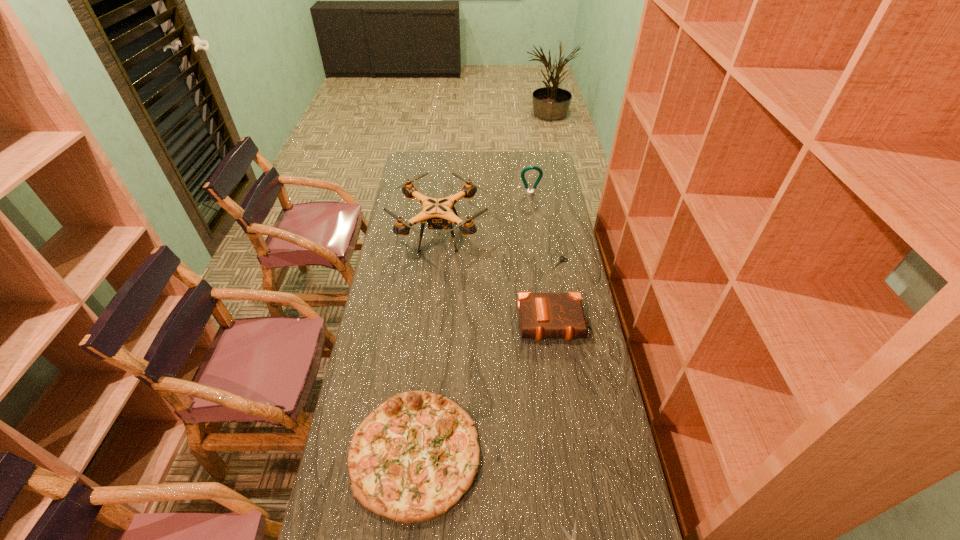
At what (x,y) coordinates should I click in order to perform the action: click on the tallest object. Please return your answer as a coordinate pair (x, y). The width and height of the screenshot is (960, 540). Looking at the image, I should click on point(437,212).

You are a GUI agent. You are given a task and a screenshot of the screen. Output one action in this format:
    pyautogui.click(x=<x>, y=<y>)
    Task: Click on the second tallest object
    Image resolution: width=960 pixels, height=540 pixels.
    Given the screenshot: What is the action you would take?
    pyautogui.click(x=538, y=169)

At what (x,y) coordinates should I click in order to perform the action: click on the farthest object. Please return your answer as a coordinate pair (x, y). Looking at the image, I should click on (538, 169).

The width and height of the screenshot is (960, 540). What are the coordinates of `Bible` in the screenshot? It's located at (542, 316).

What are the coordinates of `pizza` in the screenshot? It's located at (411, 459).

Locate an element on the screen. the taller shears is located at coordinates (561, 260).

Locate an element on the screen. The height and width of the screenshot is (540, 960). the fifth tallest object is located at coordinates (561, 260).

Where is `vacant space located on the camera mount of the tallest object`? vacant space located on the camera mount of the tallest object is located at coordinates (517, 235).

You are a GUI agent. You are given a task and a screenshot of the screen. Output one action in this format:
    pyautogui.click(x=<x>, y=<y>)
    Task: Click on the vacant region located 0.330m at the jaws of the farthest object
    
    Given the screenshot: What is the action you would take?
    pyautogui.click(x=537, y=241)

What are the coordinates of `free space located on the spine side of the Bible` in the screenshot? It's located at (573, 447).